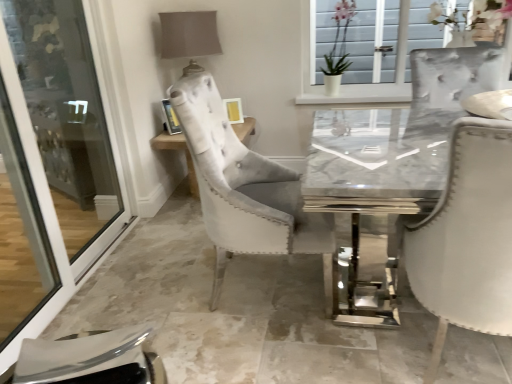
Question: From the image's perspective, is transparent glass screen door at left below marble table at center?

Choices:
 (A) yes
 (B) no

Answer: (A)

Question: Considering the relative sizes of transparent glass screen door at left and marble table at center in the image provided, is transparent glass screen door at left thinner than marble table at center?

Choices:
 (A) no
 (B) yes

Answer: (B)

Question: Considering the relative sizes of transparent glass screen door at left and marble table at center in the image provided, is transparent glass screen door at left bigger than marble table at center?

Choices:
 (A) yes
 (B) no

Answer: (B)

Question: Does transparent glass screen door at left have a smaller size compared to marble table at center?

Choices:
 (A) yes
 (B) no

Answer: (A)

Question: Considering the relative sizes of transparent glass screen door at left and marble table at center in the image provided, is transparent glass screen door at left shorter than marble table at center?

Choices:
 (A) yes
 (B) no

Answer: (B)

Question: Can you confirm if transparent glass screen door at left is positioned to the right of marble table at center?

Choices:
 (A) no
 (B) yes

Answer: (A)

Question: Does metallic silver picture frame at upper center turn towards marble table at center?

Choices:
 (A) yes
 (B) no

Answer: (B)

Question: From the image's perspective, is metallic silver picture frame at upper center located beneath marble table at center?

Choices:
 (A) yes
 (B) no

Answer: (B)

Question: Is metallic silver picture frame at upper center turned away from marble table at center?

Choices:
 (A) yes
 (B) no

Answer: (B)

Question: Is metallic silver picture frame at upper center not close to marble table at center?

Choices:
 (A) no
 (B) yes

Answer: (A)

Question: Is metallic silver picture frame at upper center outside marble table at center?

Choices:
 (A) yes
 (B) no

Answer: (A)

Question: Does metallic silver picture frame at upper center have a smaller size compared to marble table at center?

Choices:
 (A) no
 (B) yes

Answer: (B)

Question: Is transparent glass screen door at left bigger than metallic silver picture frame at upper center?

Choices:
 (A) yes
 (B) no

Answer: (A)